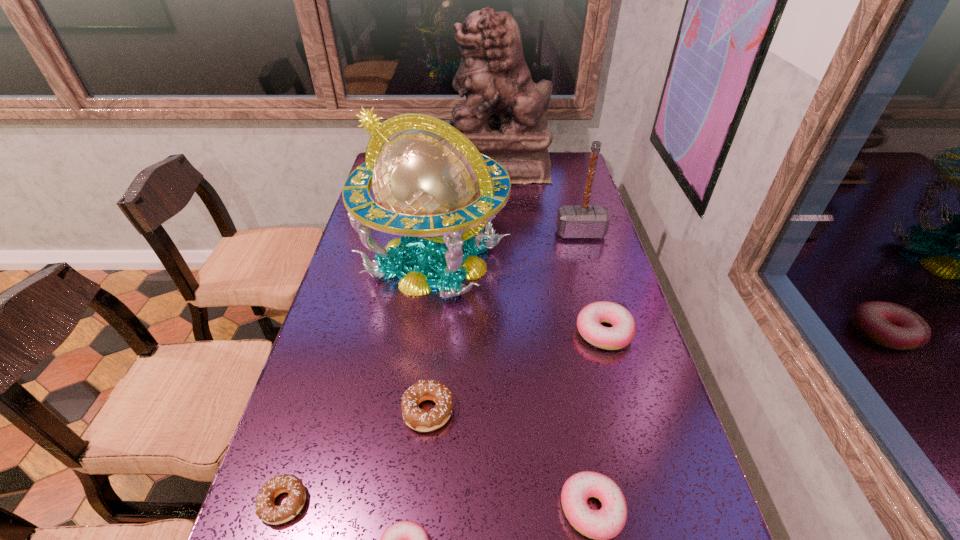
Where is `globe that is at the left edge`? globe that is at the left edge is located at coordinates (431, 184).

Locate an element on the screen. This screenshot has height=540, width=960. doughnut at the left edge is located at coordinates (265, 509).

Where is `sculpture at the right edge`? This screenshot has width=960, height=540. sculpture at the right edge is located at coordinates (504, 115).

Find the location of a particular element. This screenshot has width=960, height=540. hammer that is at the right edge is located at coordinates (x=573, y=221).

Identify the location of doughnut that is at the right edge. This screenshot has width=960, height=540. (589, 319).

Locate an element on the screen. object that is at the far right corner is located at coordinates coord(504,115).

Locate an element on the screen. The height and width of the screenshot is (540, 960). blank area at the left edge is located at coordinates (318, 354).

What are the coordinates of `free space at the right edge` in the screenshot? It's located at (618, 434).

You are a GUI agent. You are given a task and a screenshot of the screen. Output one action in this format:
    pyautogui.click(x=<x>, y=<y>)
    Task: Click on the vacant region at the far right corner of the desktop
    Image resolution: width=960 pixels, height=540 pixels.
    Given the screenshot: What is the action you would take?
    pyautogui.click(x=572, y=172)

Identify the location of vacant area between the tallest object and the biggest pink doughnut. The height and width of the screenshot is (540, 960). (551, 249).